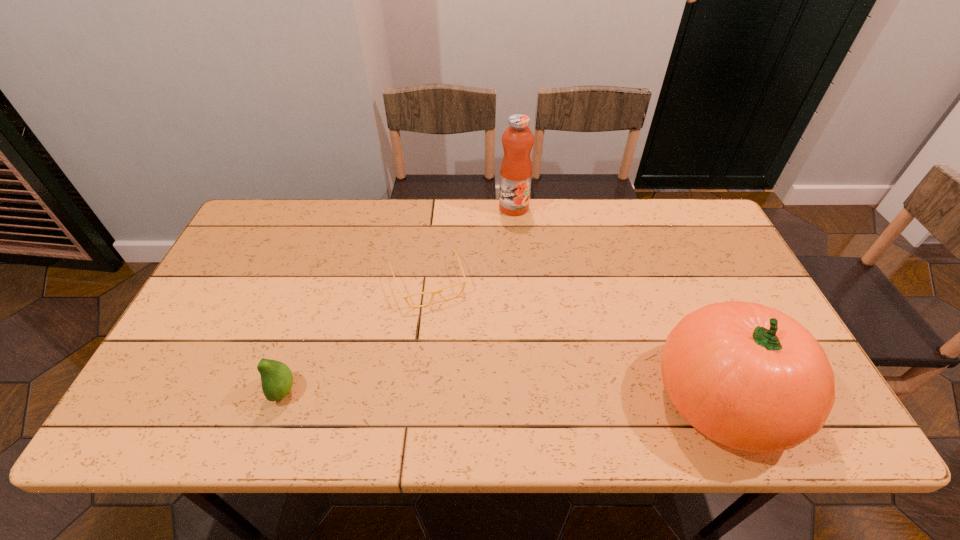
I want to click on free space on the desktop that is between the leftmost object and the third shortest object and is positioned in front of the lenses of the third object from right to left, so click(x=469, y=394).

Identify the location of free space on the desktop that is between the avocado and the third shortest object and is positioned on the front label of the farthest object. (461, 394).